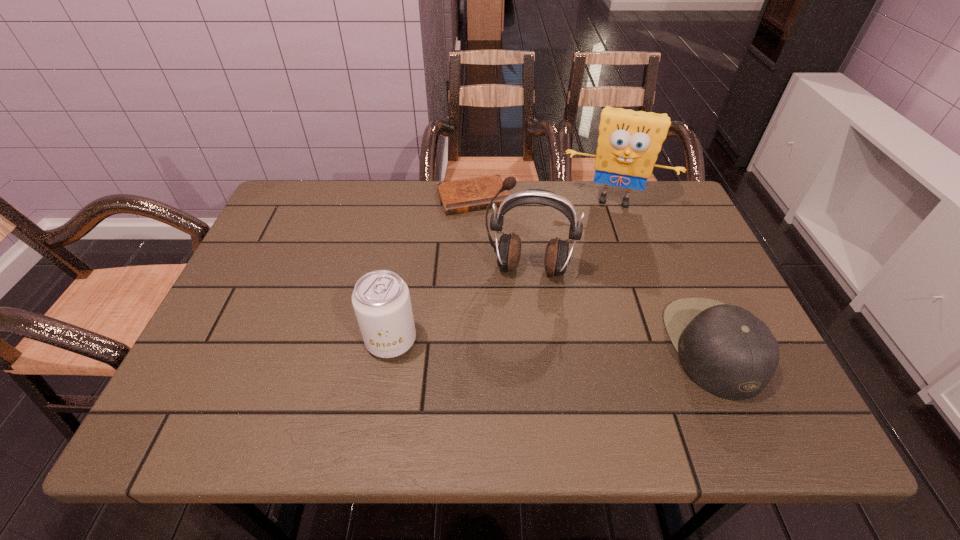
At what (x,y) coordinates should I click in order to perform the action: click on the leftmost object. Please return your answer as a coordinate pair (x, y). This screenshot has width=960, height=540. Looking at the image, I should click on (381, 300).

Locate an element on the screen. the third tallest object is located at coordinates (381, 300).

At what (x,y) coordinates should I click in order to perform the action: click on cap. Please return your answer as a coordinate pair (x, y). Looking at the image, I should click on [726, 350].

You are a GUI agent. You are given a task and a screenshot of the screen. Output one action in this format:
    pyautogui.click(x=<x>, y=<y>)
    Task: Click on the diary
    
    Given the screenshot: What is the action you would take?
    pyautogui.click(x=465, y=195)

Find the location of `the third farthest object`. the third farthest object is located at coordinates coord(557,256).

Locate an element on the screen. The width and height of the screenshot is (960, 540). sponge is located at coordinates (629, 141).

This screenshot has height=540, width=960. Identify the location of free spot located 0.200m on the left of the soda can. click(x=275, y=340).

Find the location of `vacant space positioned 0.330m on the spine side of the shortest object`. vacant space positioned 0.330m on the spine side of the shortest object is located at coordinates (519, 299).

Locate an element on the screen. The width and height of the screenshot is (960, 540). free point located 0.230m on the spine side of the shortest object is located at coordinates (507, 270).

You are a GUI agent. You are given a task and a screenshot of the screen. Output one action in this format:
    pyautogui.click(x=<x>, y=<y>)
    Task: Click on the vacant region located on the spine side of the shortest object
    
    Given the screenshot: What is the action you would take?
    pyautogui.click(x=498, y=249)